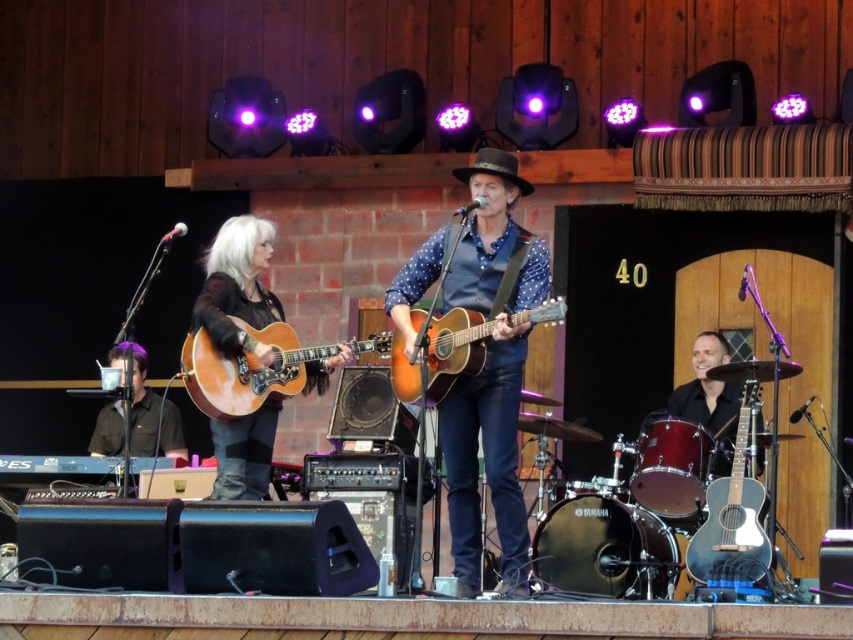
You are a photographer positioned at the front of the stage. You want to capture a clear photo of both the matte brown acoustic guitar at center and the light brown acoustic guitar at center. Which guitar will appear larger in your photo?

The matte brown acoustic guitar at center will appear larger in the photo because it is closer to the viewer than the light brown acoustic guitar at center.

From the picture: You are a photographer at the front row of the concert. You want to take a photo of both the matte brown acoustic guitar at center and the light brown acoustic guitar at center. Which guitar should you pan your camera to the right to capture?

The matte brown acoustic guitar at center is to the right of the light brown acoustic guitar at center, so you should pan your camera to the right to capture the matte brown acoustic guitar at center.

You are a stagehand setting up for a concert and need to place a microphone stand between the matte brown acoustic guitar at center and the light brown acoustic guitar at center. Since the microphone stand requires at least 30 cm of space between the guitars, can you fit it there based on their sizes?

The matte brown acoustic guitar at center is taller than the light brown acoustic guitar at center, but the description does not provide specific measurements of their widths. Therefore, it is unclear if there is enough space to fit the microphone stand between them.